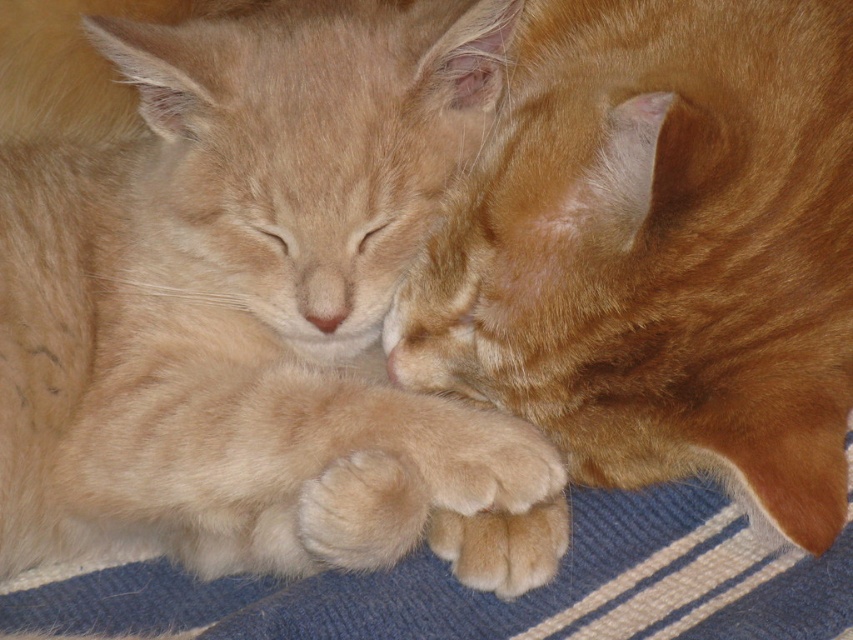
You are holding a 1.2 meter long fishing rod and want to cast it into the water without disturbing the cats. The tip of the rod must stay at least 1 meter away from the point marked at coordinates point (332, 544). Is this possible?

The point marked at coordinates point (332, 544) is 1.15 meters away from the camera. Since the tip of the rod must stay at least 1 meter away, and the point is already 1.15 meters away, the fishing rod can be cast without violating the distance requirement.

You are a photographer trying to capture the soft orange fur paw at center in the image of two resting cats. Based on its coordinates, where exactly is this paw positioned relative to the frame?

The soft orange fur paw at center is located at point coordinates of 0.800 on the x axis and 0.427 on the y axis.

You are standing in front of the image and want to point out the two cats. Which cat is closer to you, the one at point (492, 1) or the one at point (459, 531)?

The cat at point (492, 1) is closer to you because point (492, 1) is in front of point (459, 531).